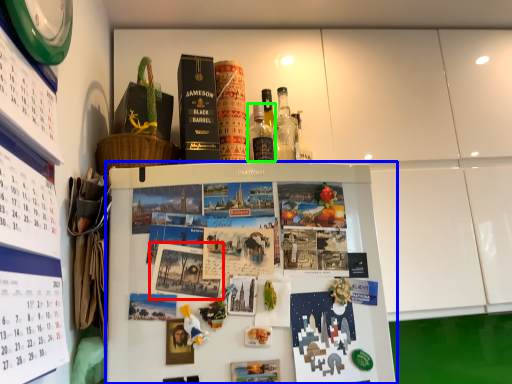
Question: Estimate the real-world distances between objects in this image. Which object is closer to book cover (highlighted by a red box), refrigerator (highlighted by a blue box) or bottle (highlighted by a green box)?

Choices:
 (A) refrigerator
 (B) bottle

Answer: (A)